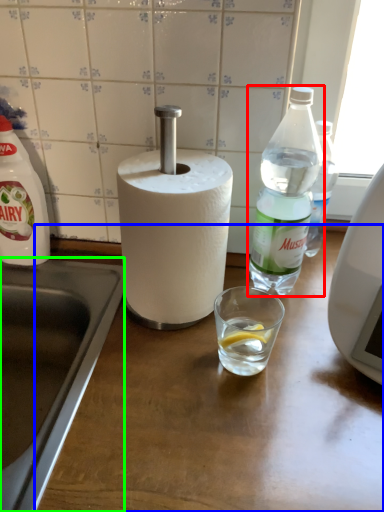
Question: Which object is positioned farthest from bottle (highlighted by a red box)? Select from counter top (highlighted by a blue box) and sink (highlighted by a green box).

Choices:
 (A) counter top
 (B) sink

Answer: (B)